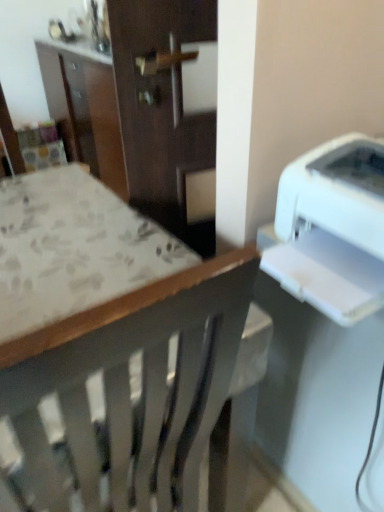
Question: Does wooden chair at center appear on the right side of white plastic printer at right?

Choices:
 (A) no
 (B) yes

Answer: (A)

Question: Does wooden chair at center come behind white plastic printer at right?

Choices:
 (A) yes
 (B) no

Answer: (B)

Question: From the image's perspective, does wooden chair at center appear higher than white plastic printer at right?

Choices:
 (A) no
 (B) yes

Answer: (A)

Question: Is wooden chair at center at the left side of white plastic printer at right?

Choices:
 (A) yes
 (B) no

Answer: (A)

Question: Considering the relative sizes of wooden chair at center and white plastic printer at right in the image provided, is wooden chair at center shorter than white plastic printer at right?

Choices:
 (A) yes
 (B) no

Answer: (B)

Question: Is wooden chair at center bigger than white plastic printer at right?

Choices:
 (A) no
 (B) yes

Answer: (B)

Question: From the image's perspective, would you say white plastic printer at right is positioned over wooden chair at center?

Choices:
 (A) yes
 (B) no

Answer: (A)

Question: Could you tell me if white plastic printer at right is turned towards wooden chair at center?

Choices:
 (A) no
 (B) yes

Answer: (A)

Question: Is white plastic printer at right bigger than wooden chair at center?

Choices:
 (A) yes
 (B) no

Answer: (B)

Question: Considering the relative sizes of white plastic printer at right and wooden chair at center in the image provided, is white plastic printer at right thinner than wooden chair at center?

Choices:
 (A) yes
 (B) no

Answer: (A)

Question: Considering the relative sizes of white plastic printer at right and wooden chair at center in the image provided, is white plastic printer at right smaller than wooden chair at center?

Choices:
 (A) no
 (B) yes

Answer: (B)

Question: Is white plastic printer at right shorter than wooden chair at center?

Choices:
 (A) no
 (B) yes

Answer: (B)

Question: Looking at the image, does white plastic printer at right seem bigger or smaller compared to wooden chair at center?

Choices:
 (A) small
 (B) big

Answer: (A)